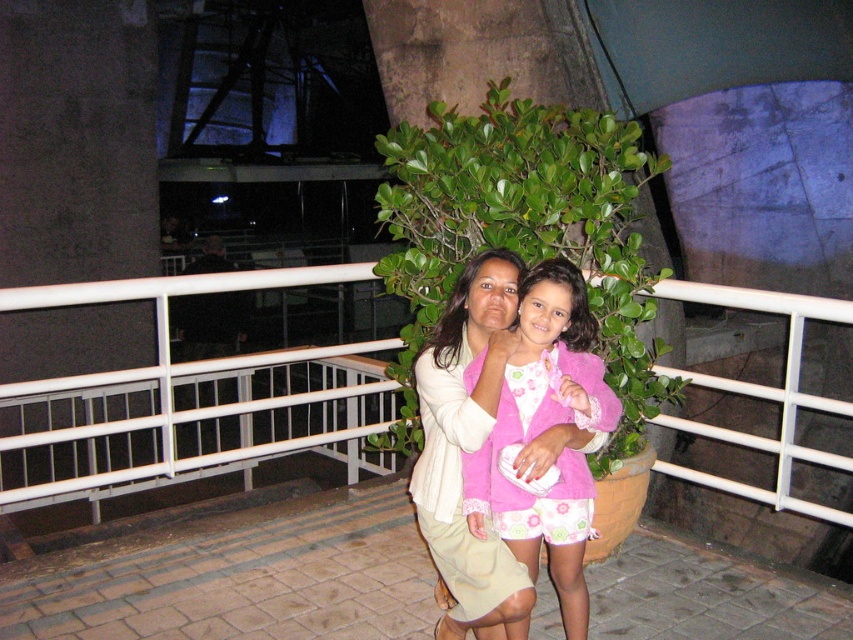
Question: Is pink fuzzy jacket at center smaller than light beige fabric jacket at center?

Choices:
 (A) no
 (B) yes

Answer: (B)

Question: Does white metal balustrade at center appear on the right side of light beige fabric jacket at center?

Choices:
 (A) no
 (B) yes

Answer: (A)

Question: Which point is closer to the camera?

Choices:
 (A) pink fuzzy jacket at center
 (B) white metal balustrade at center

Answer: (A)

Question: Which point is farther to the camera?

Choices:
 (A) light beige fabric jacket at center
 (B) white metal balustrade at center

Answer: (B)

Question: Which point is closer to the camera?

Choices:
 (A) pink fuzzy jacket at center
 (B) light beige fabric jacket at center

Answer: (B)

Question: From the image, what is the correct spatial relationship of white metal balustrade at center in relation to pink fuzzy jacket at center?

Choices:
 (A) below
 (B) above

Answer: (A)